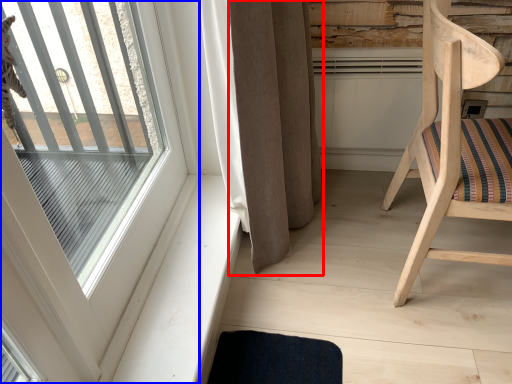
Question: Which point is closer to the camera, curtain (highlighted by a red box) or window (highlighted by a blue box)?

Choices:
 (A) curtain
 (B) window

Answer: (B)